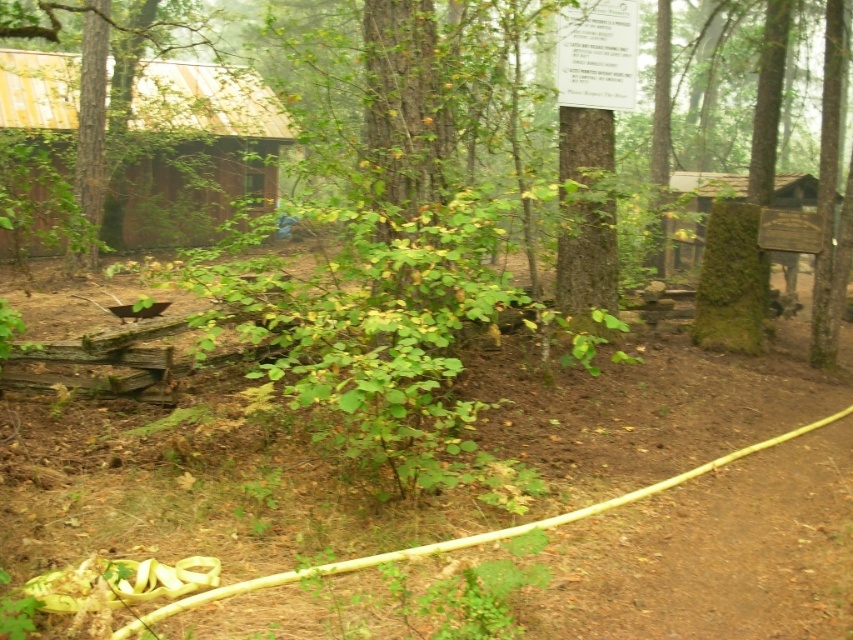
You are planning to build a fence that needs to match the width of either the brown wooden cabin at left or the green mossy sign at upper right. Which object should you use as a reference to ensure the fence is wider?

The brown wooden cabin at left is wider than the green mossy sign at upper right, so you should use the brown wooden cabin at left as a reference to ensure the fence is wider.

You are a gardener who needs to decide whether to place the yellow rubber hose at lower center near the brown wooden cabin at left. Considering their sizes, which object is wider?

The yellow rubber hose at lower center is wider than the brown wooden cabin at left.

You are standing at the point marked as point (358, 486) in the image. What object are you currently standing on?

You are standing on the yellow rubber hose at lower center because the point (358, 486) is on it.